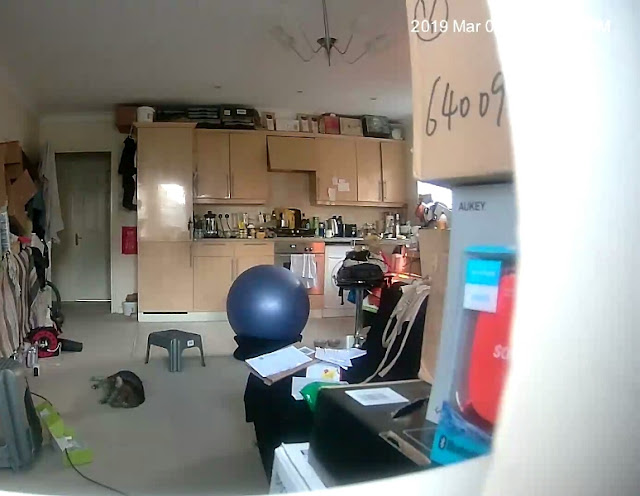
Locate an element on the screen. The width and height of the screenshot is (640, 496). black power cord is located at coordinates (41, 395), (86, 477).